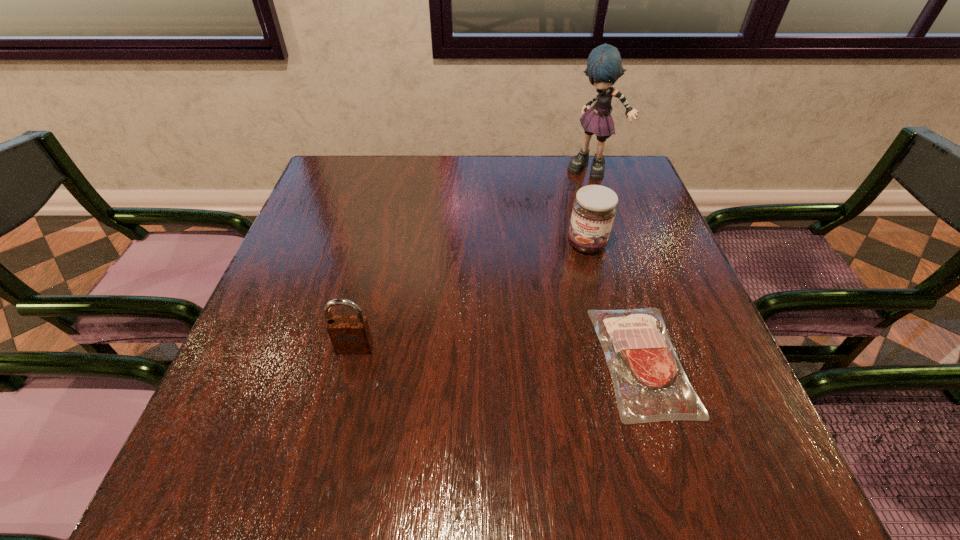
Locate an element on the screen. Image resolution: width=960 pixels, height=540 pixels. free space on the desktop that is between the leftmost object and the shortest object and is positioned on the front-facing side of the tallest object is located at coordinates (539, 356).

Where is `vacant space on the desktop that is between the leftmost object and the shortest object and is positioned on the front label of the jam`? This screenshot has width=960, height=540. vacant space on the desktop that is between the leftmost object and the shortest object and is positioned on the front label of the jam is located at coordinates pyautogui.click(x=536, y=356).